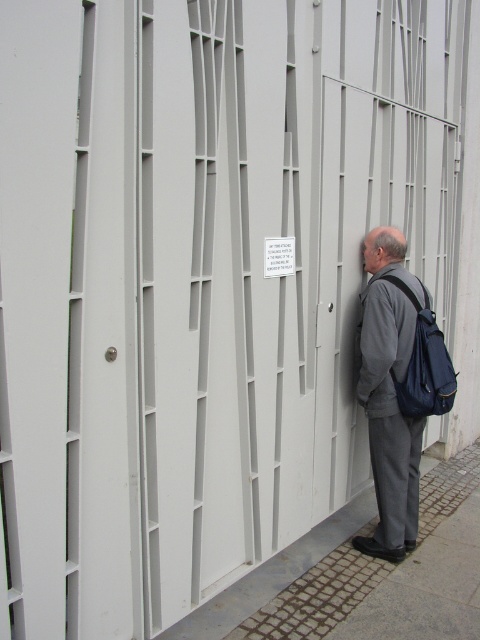
Question: Considering the relative positions of gray cobblestone pavement at lower right and gray fabric backpack at right in the image provided, where is gray cobblestone pavement at lower right located with respect to gray fabric backpack at right?

Choices:
 (A) above
 (B) below

Answer: (B)

Question: Which point is closer to the camera?

Choices:
 (A) (268, 561)
 (B) (361, 547)

Answer: (A)

Question: Does gray cobblestone pavement at lower right have a greater width compared to gray fabric backpack at right?

Choices:
 (A) no
 (B) yes

Answer: (B)

Question: Which object is farther from the camera taking this photo?

Choices:
 (A) gray fabric backpack at right
 (B) gray cobblestone pavement at lower right

Answer: (A)

Question: In this image, where is gray cobblestone pavement at lower right located relative to gray fabric backpack at right?

Choices:
 (A) left
 (B) right

Answer: (B)